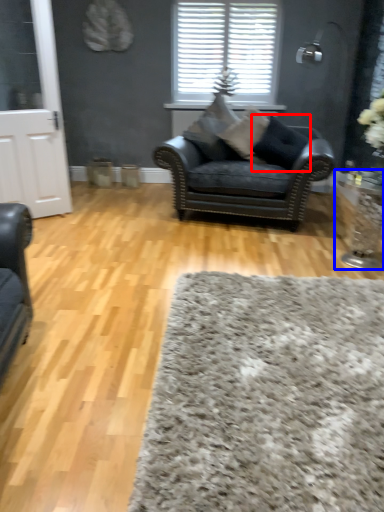
Question: Which point is further to the camera, pillow (highlighted by a red box) or side table (highlighted by a blue box)?

Choices:
 (A) pillow
 (B) side table

Answer: (A)